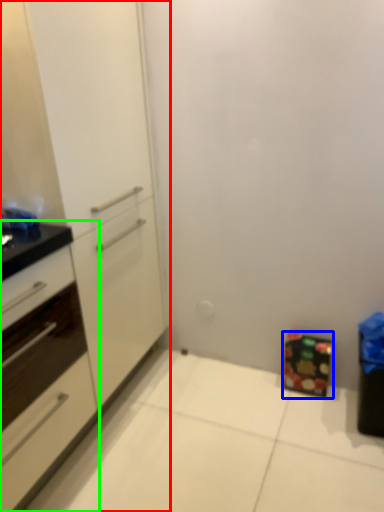
Question: Estimate the real-world distances between objects in this image. Which object is farther from cabinetry (highlighted by a red box), cabinetry (highlighted by a blue box) or cabinetry (highlighted by a green box)?

Choices:
 (A) cabinetry
 (B) cabinetry

Answer: (A)